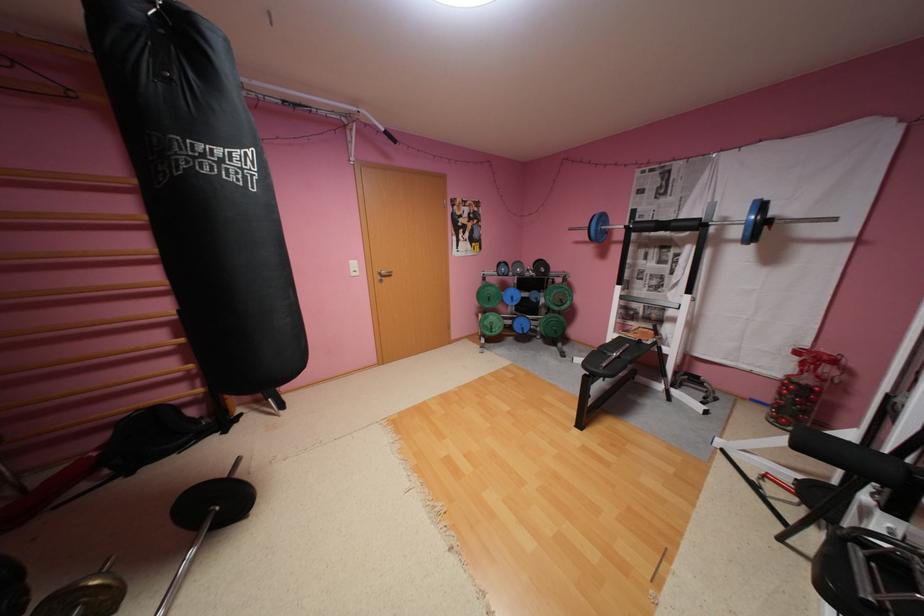
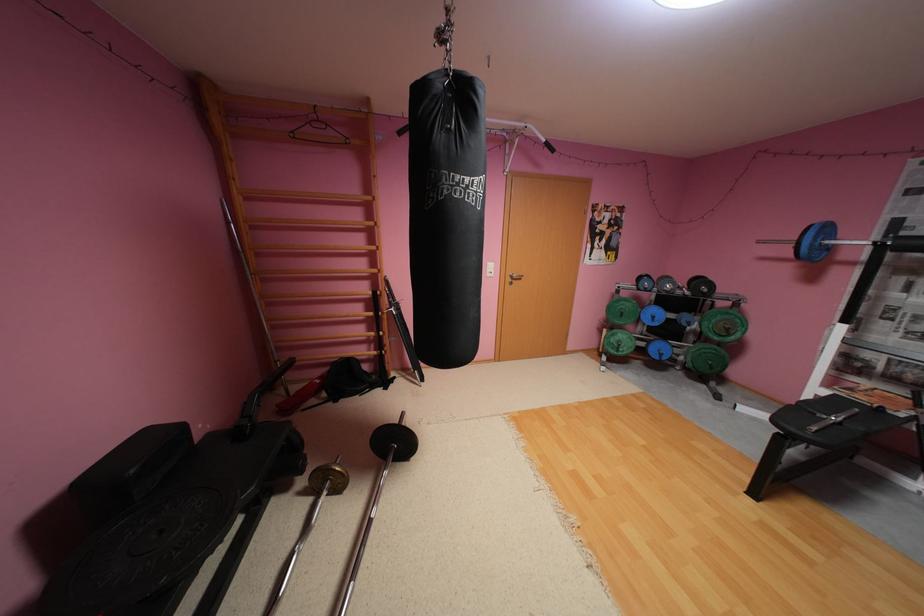
The point at [612,217] is marked in the first image. Where is the corresponding point in the second image?

(835, 229)